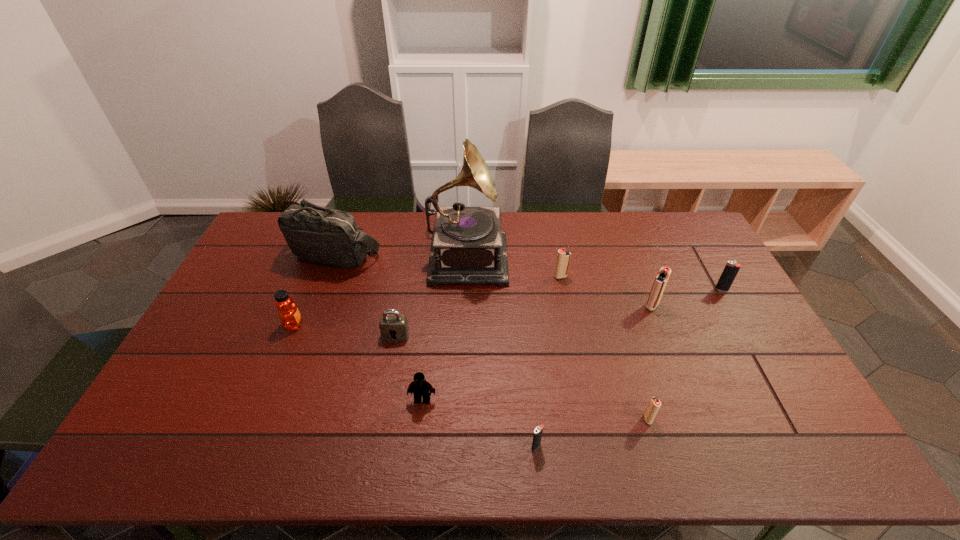
You are a GUI agent. You are given a task and a screenshot of the screen. Output one action in this format:
    pyautogui.click(x=<x>, y=<y>)
    Task: Click on the vacant space situated on the front label of the honey
    
    Given the screenshot: What is the action you would take?
    pyautogui.click(x=426, y=325)

Find the location of `vacant area situated 0.380m on the left of the bigger black igniter`. vacant area situated 0.380m on the left of the bigger black igniter is located at coordinates (600, 289).

You are a GUI agent. You are given a task and a screenshot of the screen. Output one action in this format:
    pyautogui.click(x=<x>, y=<y>)
    Task: Click on the vacant space positioned on the right of the farthest igniter
    Image resolution: width=960 pixels, height=540 pixels.
    Given the screenshot: What is the action you would take?
    pyautogui.click(x=588, y=276)

Where is `vacant space located at the front of the third object from left to right near the keyhole`? The image size is (960, 540). vacant space located at the front of the third object from left to right near the keyhole is located at coordinates (391, 361).

Where is `free spot located 0.160m on the face of the black Lego`? free spot located 0.160m on the face of the black Lego is located at coordinates (x=415, y=466).

In order to click on vacant space located on the back of the second nearest igniter in this screenshot , I will do `click(628, 353)`.

Where is `vacant space situated on the back of the sixth object from left to right`? The image size is (960, 540). vacant space situated on the back of the sixth object from left to right is located at coordinates (529, 373).

This screenshot has width=960, height=540. I want to click on record player located at the far edge, so click(x=468, y=246).

Image resolution: width=960 pixels, height=540 pixels. In order to click on shoulder bag that is at the far edge in this screenshot , I will do `click(319, 235)`.

Find the location of a particular element. The height and width of the screenshot is (540, 960). object at the near edge is located at coordinates (538, 431).